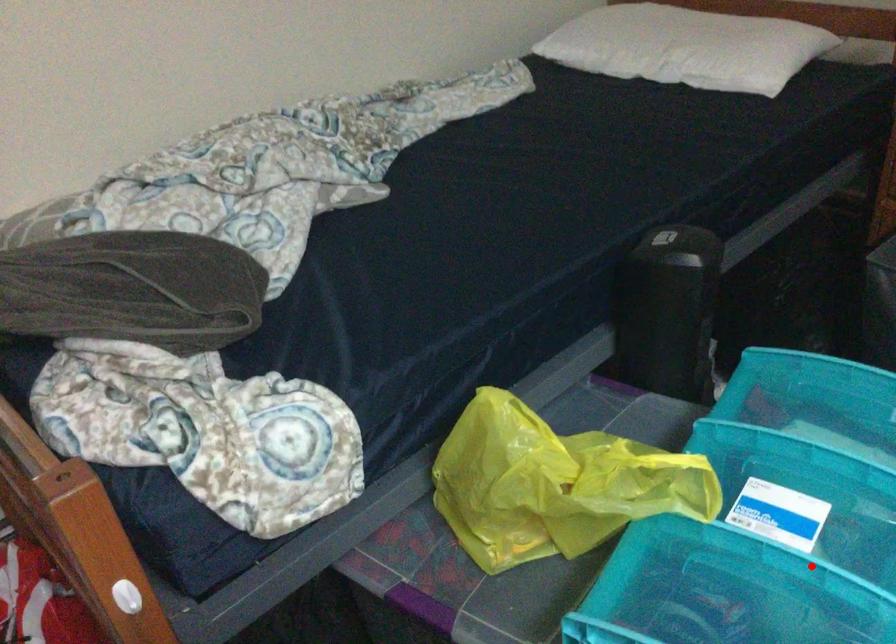
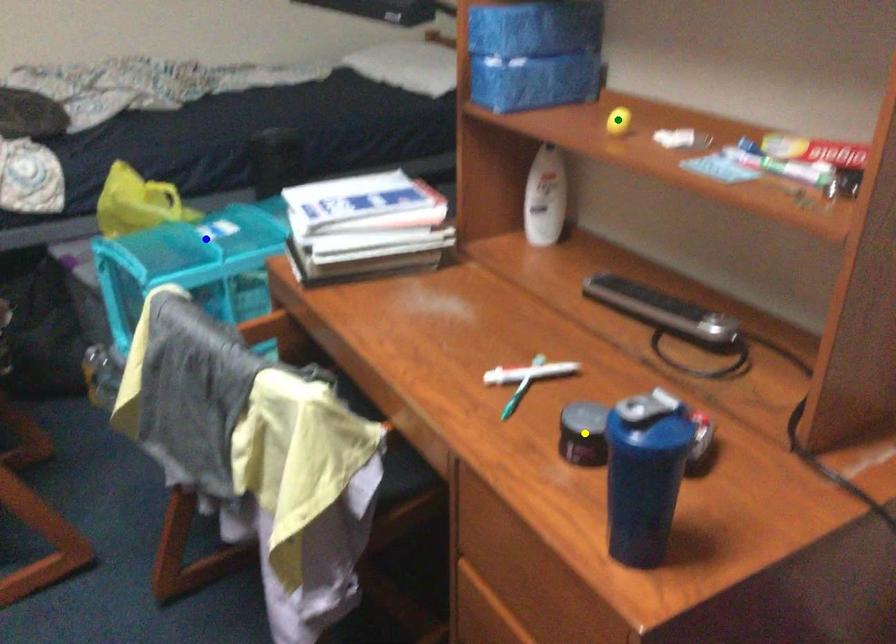
Question: I am providing you with two images of the same scene from different viewpoints. A red point is marked on the first image. You are given multiple points on the second image. In image 2, which mark is for the same physical point as the one in image 1?

Choices:
 (A) green point
 (B) blue point
 (C) yellow point

Answer: (B)